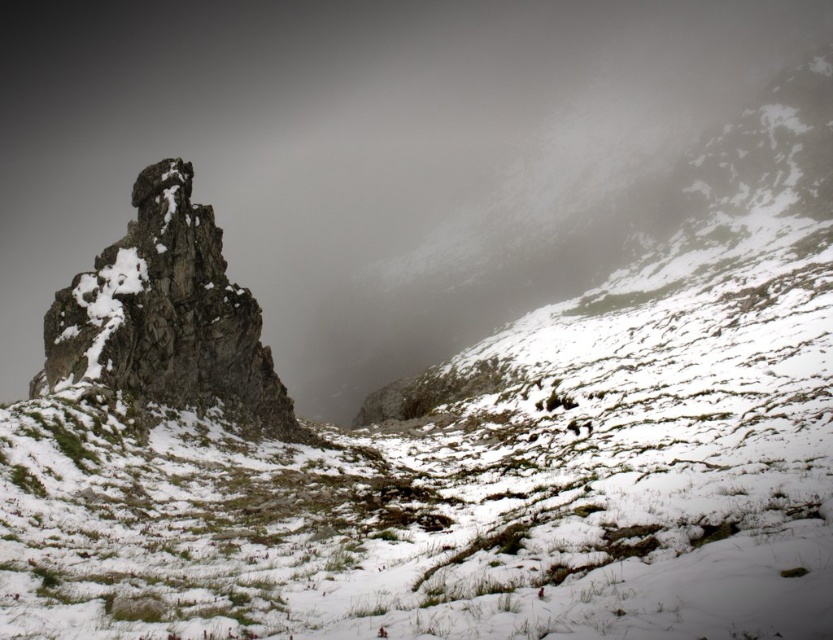
Question: Among these points, which one is nearest to the camera?

Choices:
 (A) (150, 129)
 (B) (153, 296)

Answer: (B)

Question: Which of the following is the closest to the observer?

Choices:
 (A) (181, 195)
 (B) (791, 32)

Answer: (A)

Question: Which point is closer to the camera?

Choices:
 (A) rough stone rock at left
 (B) white foggy cloud at upper center

Answer: (A)

Question: Can you confirm if white foggy cloud at upper center is smaller than rough stone rock at left?

Choices:
 (A) yes
 (B) no

Answer: (B)

Question: Is white foggy cloud at upper center to the left of rough stone rock at left from the viewer's perspective?

Choices:
 (A) no
 (B) yes

Answer: (B)

Question: Is white foggy cloud at upper center to the left of rough stone rock at left from the viewer's perspective?

Choices:
 (A) yes
 (B) no

Answer: (A)